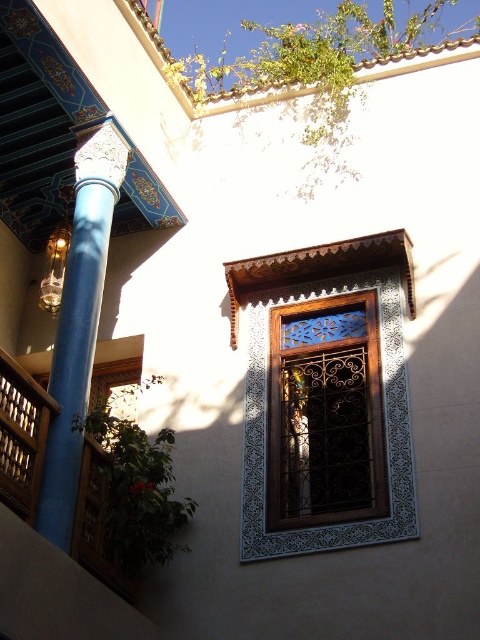
Question: Which of the following is the farthest from the observer?

Choices:
 (A) (345, 508)
 (B) (44, 502)
 (C) (31, 384)

Answer: (A)

Question: Which object is farther from the camera taking this photo?

Choices:
 (A) wooden lattice window at center
 (B) wooden at left

Answer: (A)

Question: Does wooden lattice window at center have a larger size compared to clear glass lamp at left?

Choices:
 (A) no
 (B) yes

Answer: (B)

Question: Is blue glossy column at left positioned in front of wooden lattice at lower left?

Choices:
 (A) yes
 (B) no

Answer: (A)

Question: Which of these objects is positioned farthest from the wooden at left?

Choices:
 (A) wooden lattice at lower left
 (B) clear glass lamp at left
 (C) blue glossy column at left

Answer: (B)

Question: Where is blue glossy column at left located in relation to clear glass lamp at left in the image?

Choices:
 (A) above
 (B) below

Answer: (B)